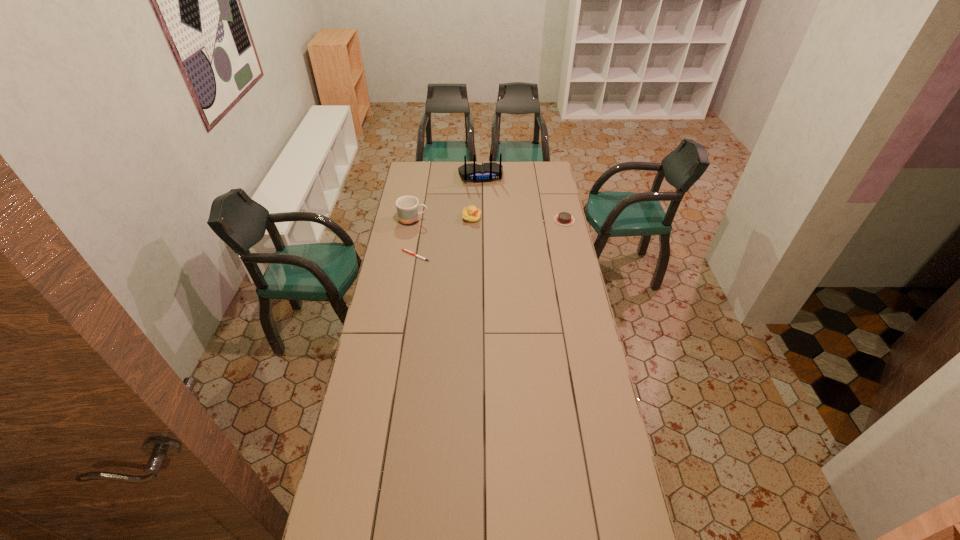
Identify the location of vacant space situated 0.090m on the front of the chocolate cake. (568, 237).

Find the location of a particular element. Image resolution: width=960 pixels, height=540 pixels. vacant area located at the face of the duckling is located at coordinates (533, 240).

What are the coordinates of `vacant region located 0.190m at the face of the duckling` in the screenshot? It's located at (511, 232).

What are the coordinates of `vacant space positioned 0.150m at the face of the duckling` in the screenshot? It's located at (504, 230).

Identify the location of vacant space positioned on the side with the handle of the fourth shortest object. (465, 226).

Find the location of a particular element. vacant point located 0.150m on the side with the handle of the fourth shortest object is located at coordinates (455, 224).

Image resolution: width=960 pixels, height=540 pixels. Find the location of `free space located 0.370m on the side with the handle of the fourth shortest object`. free space located 0.370m on the side with the handle of the fourth shortest object is located at coordinates (495, 230).

The image size is (960, 540). I want to click on free point located on the back of the farthest object, so [491, 222].

Locate an element on the screen. The width and height of the screenshot is (960, 540). vacant region located on the back of the farthest object is located at coordinates (489, 214).

This screenshot has height=540, width=960. Find the location of `blank area located on the back of the farthest object`. blank area located on the back of the farthest object is located at coordinates (488, 208).